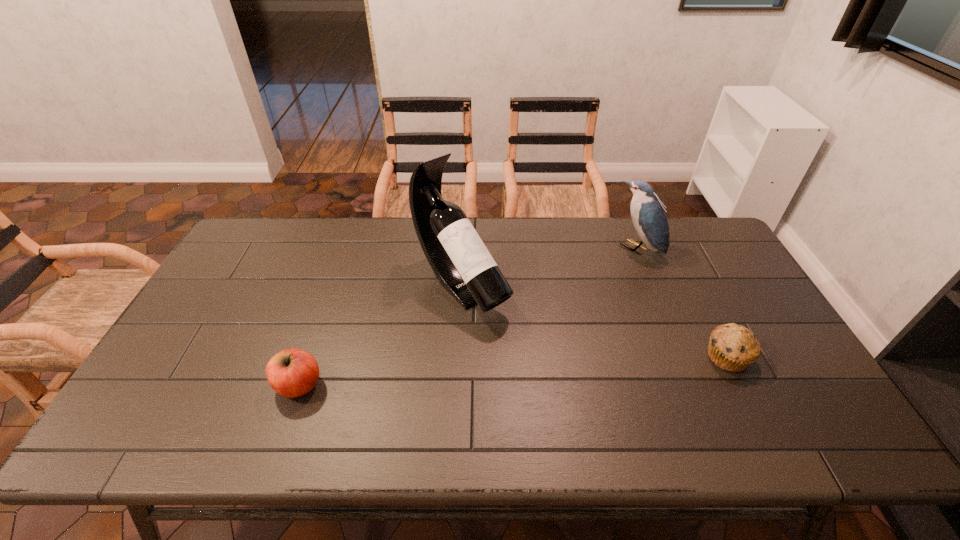
Where is `blank space located 0.090m on the stand of the wine bottle`? This screenshot has width=960, height=540. blank space located 0.090m on the stand of the wine bottle is located at coordinates (511, 340).

Find the location of `free space located at the tip of the third shortest object's beak`. free space located at the tip of the third shortest object's beak is located at coordinates (608, 272).

Locate an element on the screen. The width and height of the screenshot is (960, 540). vacant space situated at the tip of the third shortest object's beak is located at coordinates (588, 289).

Locate an element on the screen. vacant space situated at the tip of the third shortest object's beak is located at coordinates (567, 306).

The width and height of the screenshot is (960, 540). I want to click on wine bottle that is at the far edge, so click(463, 265).

Locate an element on the screen. The height and width of the screenshot is (540, 960). bird situated at the far edge is located at coordinates (648, 214).

At what (x,y) coordinates should I click in order to perform the action: click on object situated at the near edge. Please return your answer as a coordinate pair (x, y). The image size is (960, 540). Looking at the image, I should click on (291, 373).

This screenshot has height=540, width=960. Identify the location of object that is at the right edge. (733, 348).

Where is `vacant space at the far edge`? The width and height of the screenshot is (960, 540). vacant space at the far edge is located at coordinates coord(516,256).

What are the coordinates of `vacant space at the near edge of the desktop` in the screenshot? It's located at (398, 408).